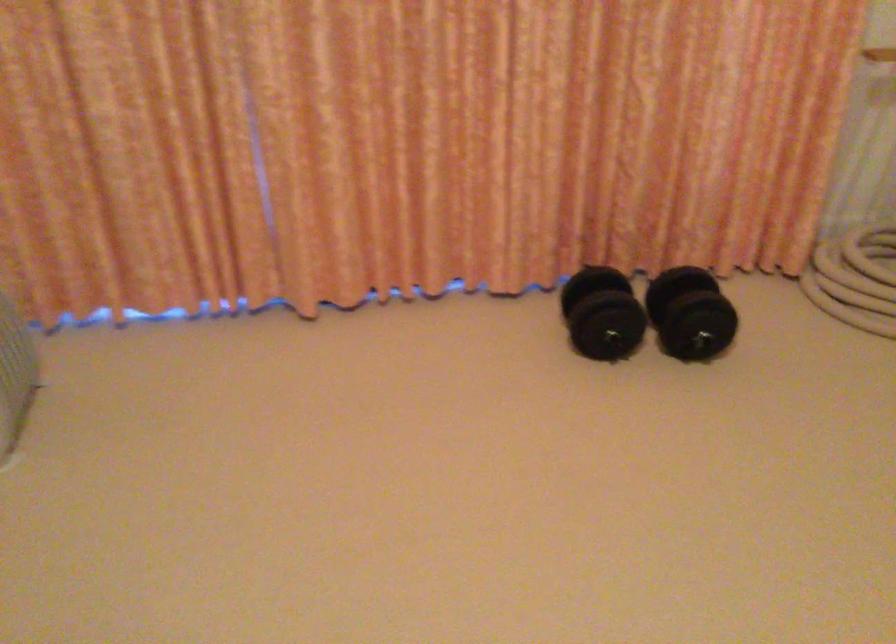
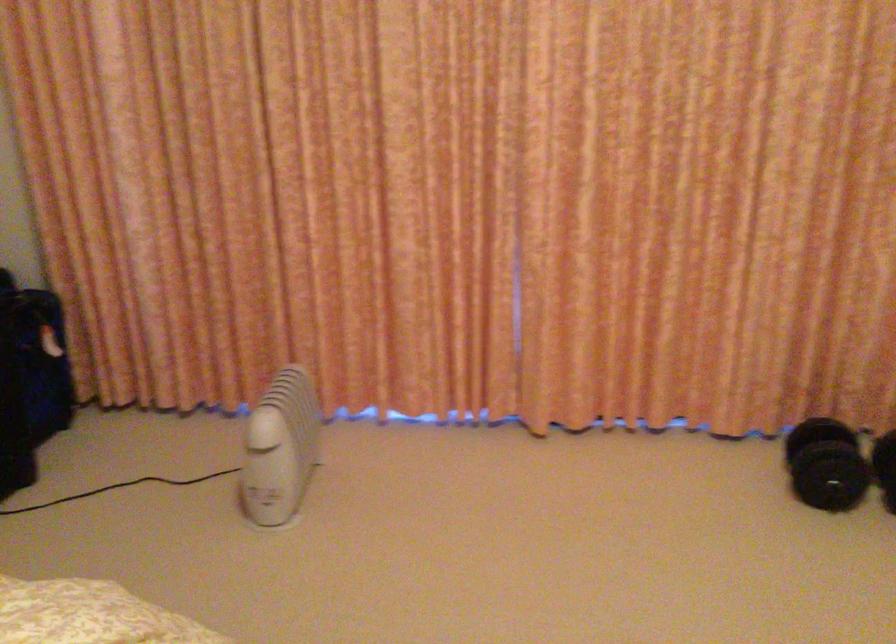
Question: The images are taken continuously from a first-person perspective. In which direction are you moving?

Choices:
 (A) Left
 (B) Right
 (C) Forward
 (D) Backward

Answer: (D)